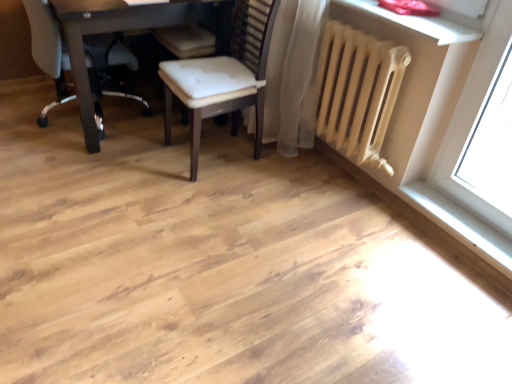
The width and height of the screenshot is (512, 384). What are the coordinates of `vacant region below wooden chair at center, which is the 2th chair in left-to-right order (from a real-world perspective)` in the screenshot? It's located at (225, 152).